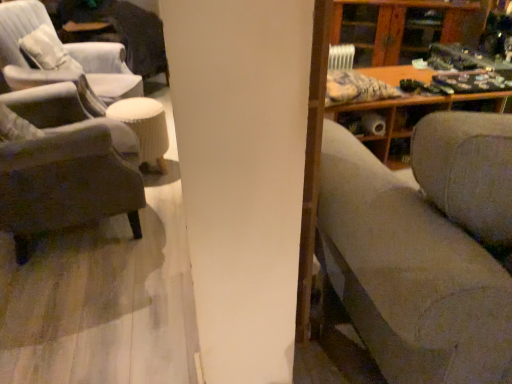
Question: Considering the positions of textured gray couch at right and matte gray chair at left, which ranks as the 2th chair in front-to-back order, in the image, is textured gray couch at right wider or thinner than matte gray chair at left, which ranks as the 2th chair in front-to-back order,?

Choices:
 (A) wide
 (B) thin

Answer: (A)

Question: Is textured gray couch at right situated inside matte gray chair at left, which ranks as the 2th chair in front-to-back order, or outside?

Choices:
 (A) outside
 (B) inside

Answer: (A)

Question: Which object is positioned closest to the velvet gray armchair at left, which is the 2th chair in back-to-front order?

Choices:
 (A) textured gray couch at right
 (B) wooden cabinet at upper right
 (C) matte gray chair at left, which ranks as the 2th chair in front-to-back order
 (D) white ribbed stool at center

Answer: (D)

Question: Considering the real-world distances, which object is farthest from the matte gray chair at left, which is the 1th chair in back-to-front order?

Choices:
 (A) white ribbed stool at center
 (B) wooden cabinet at upper right
 (C) textured gray couch at right
 (D) velvet gray armchair at left, which is the 2th chair in back-to-front order

Answer: (B)